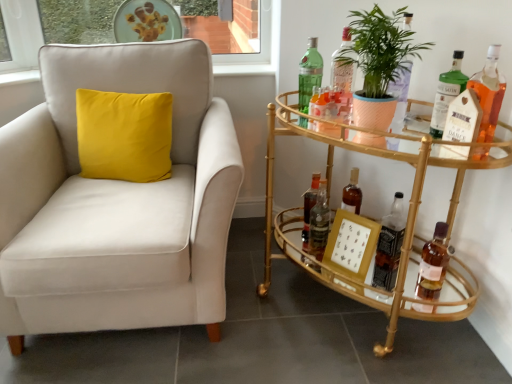
Question: Considering the relative sizes of green matte plant at right and translucent glass bottle at center, the fifth bottle when ordered from left to right, in the image provided, is green matte plant at right taller than translucent glass bottle at center, the fifth bottle when ordered from left to right,?

Choices:
 (A) no
 (B) yes

Answer: (B)

Question: Is green matte plant at right next to translucent glass bottle at center, which is the 4th bottle from right to left, and touching it?

Choices:
 (A) no
 (B) yes

Answer: (A)

Question: From the image's perspective, is green matte plant at right over translucent glass bottle at center, the fifth bottle when ordered from left to right?

Choices:
 (A) no
 (B) yes

Answer: (B)

Question: From the image's perspective, is green matte plant at right below translucent glass bottle at center, which is the 4th bottle from right to left?

Choices:
 (A) yes
 (B) no

Answer: (B)

Question: Does green matte plant at right have a larger size compared to translucent glass bottle at center, the fifth bottle when ordered from left to right?

Choices:
 (A) yes
 (B) no

Answer: (A)

Question: Considering the positions of translucent amber glass bottle at lower right, positioned as the seventh bottle in left-to-right order, and green glass bottle at right, the 6th bottle from the left, in the image, is translucent amber glass bottle at lower right, positioned as the seventh bottle in left-to-right order, bigger or smaller than green glass bottle at right, the 6th bottle from the left,?

Choices:
 (A) small
 (B) big

Answer: (B)

Question: In terms of width, does translucent amber glass bottle at lower right, positioned as the seventh bottle in left-to-right order, look wider or thinner when compared to green glass bottle at right, the 6th bottle from the left?

Choices:
 (A) wide
 (B) thin

Answer: (A)

Question: From a real-world perspective, is translucent amber glass bottle at lower right, positioned as the seventh bottle in left-to-right order, positioned above or below green glass bottle at right, the third bottle from the right?

Choices:
 (A) below
 (B) above

Answer: (A)

Question: Does point click(x=432, y=269) appear closer or farther from the camera than point click(x=446, y=97)?

Choices:
 (A) closer
 (B) farther

Answer: (B)

Question: From a real-world perspective, relative to suede beige armchair at left, is translucent glass bottle at center, acting as the second bottle starting from the left, vertically above or below?

Choices:
 (A) above
 (B) below

Answer: (B)

Question: Looking at the image, does translucent glass bottle at center, which is the 7th bottle from right to left, seem bigger or smaller compared to suede beige armchair at left?

Choices:
 (A) big
 (B) small

Answer: (B)

Question: Choose the correct answer: Is translucent glass bottle at center, acting as the second bottle starting from the left, inside suede beige armchair at left or outside it?

Choices:
 (A) inside
 (B) outside

Answer: (B)

Question: In terms of height, does translucent glass bottle at center, acting as the second bottle starting from the left, look taller or shorter compared to suede beige armchair at left?

Choices:
 (A) short
 (B) tall

Answer: (A)

Question: Would you say translucent amber glass bottle at lower right, positioned as the seventh bottle in left-to-right order, is inside or outside translucent glass bottle at center, the fifth bottle when ordered from left to right?

Choices:
 (A) inside
 (B) outside

Answer: (B)

Question: From a real-world perspective, is translucent amber glass bottle at lower right, positioned as the second bottle in right-to-left order, positioned above or below translucent glass bottle at center, which is the 4th bottle from right to left?

Choices:
 (A) above
 (B) below

Answer: (B)